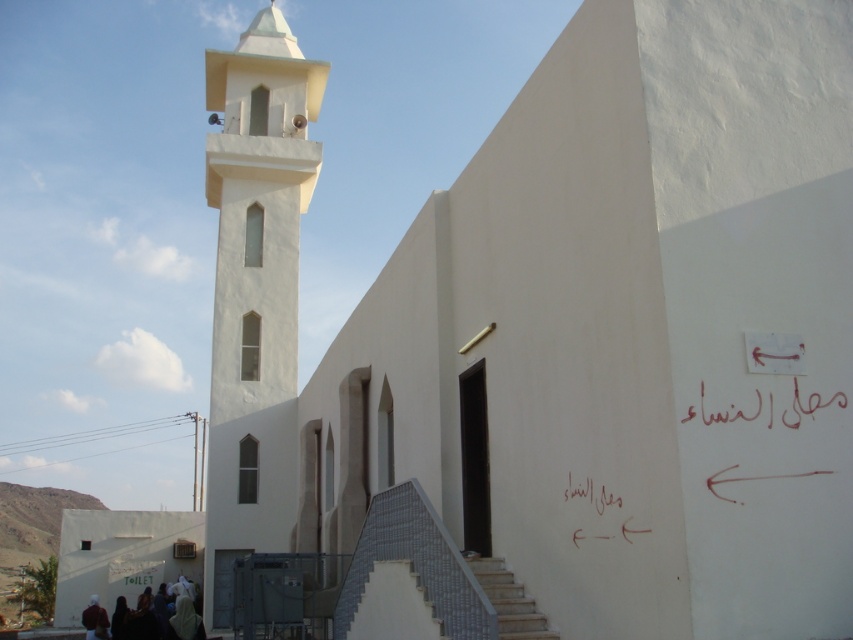
How far apart are white fabric people at lower left and handwritten red calligraphy at upper right?

white fabric people at lower left is 64.76 feet away from handwritten red calligraphy at upper right.

Measure the distance between white fabric people at lower left and camera.

white fabric people at lower left and camera are 21.91 meters apart from each other.

Does point (149, 620) lie in front of point (734, 419)?

No, (149, 620) is behind (734, 419).

Identify the location of white fabric people at lower left. The width and height of the screenshot is (853, 640). (154, 621).

Between gray textured stairs at lower center and gray concrete stairs at lower center, which one has more height?

gray concrete stairs at lower center

Between gray textured stairs at lower center and gray concrete stairs at lower center, which one has less height?

With less height is gray textured stairs at lower center.

Is point (511, 586) farther from viewer compared to point (514, 604)?

Yes, point (511, 586) is farther from viewer.

At what (x,y) coordinates should I click in order to perform the action: click on gray textured stairs at lower center. Please return your answer as a coordinate pair (x, y). This screenshot has width=853, height=640. Looking at the image, I should click on (426, 580).

From the picture: Who is taller, white smooth minaret at center or handwritten text at center?

white smooth minaret at center is taller.

Consider the image. Can you confirm if white smooth minaret at center is positioned below handwritten text at center?

No.

Is point (283, 296) positioned behind point (566, 499)?

Yes.

Locate an element on the screen. This screenshot has height=640, width=853. white smooth minaret at center is located at coordinates (254, 291).